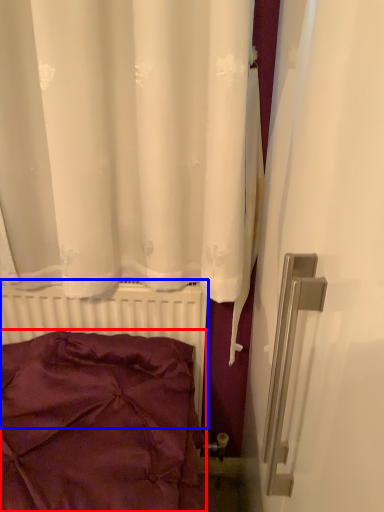
Question: Which object is further to the camera taking this photo, pillow (highlighted by a red box) or radiator (highlighted by a blue box)?

Choices:
 (A) pillow
 (B) radiator

Answer: (B)